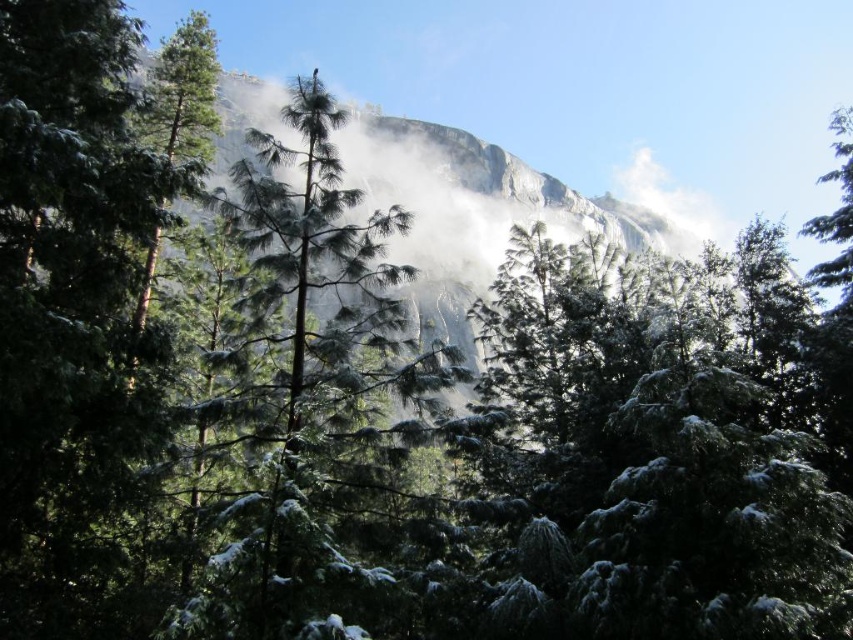
You are standing in the forest scene described. There is a green matte tree at center located at point (311, 403). If you face directly towards the mountain in the background, will the green matte tree at center block your view of the mountain?

The green matte tree at center is located at point (311, 403), which is in the center of the scene. Since the mountain is in the background and the trees are densely packed in the foreground, the green matte tree at center would likely block your view of the mountain when facing directly towards it.

You are an environmental scientist assessing the forest. You need to determine which object between the green matte tree at center and the rocky cliff at center has a smaller diameter. Which one is it?

The green matte tree at center is thinner than the rocky cliff at center, so the green matte tree at center has a smaller diameter.

You are standing in the forest scene described. There is a point marked at coordinates (466, 212). What does this point indicate?

The point at coordinates (466, 212) marks the location of a rocky cliff at the center of the scene.